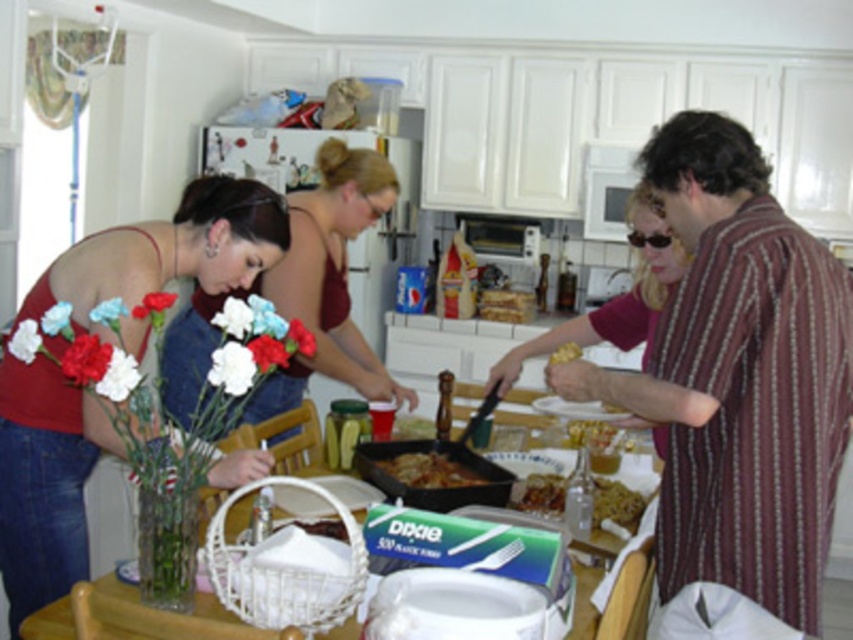
Question: Which point appears farthest from the camera in this image?

Choices:
 (A) (x=554, y=349)
 (B) (x=409, y=476)
 (C) (x=1, y=404)

Answer: (A)

Question: In this image, where is shiny brown rice at center located relative to golden crispy pastry at right?

Choices:
 (A) left
 (B) right

Answer: (B)

Question: Where is brown matte pan at center located in relation to golden crispy fries at center in the image?

Choices:
 (A) left
 (B) right

Answer: (A)

Question: Which point is farther from the camera taking this photo?

Choices:
 (A) (532, 497)
 (B) (128, 253)
 (C) (514, 506)
 (D) (389, 461)

Answer: (D)

Question: Is matte red blouse at left behind brown matte pan at center?

Choices:
 (A) yes
 (B) no

Answer: (B)

Question: Which point is closer to the camera taking this photo?

Choices:
 (A) (358, 184)
 (B) (51, 499)
 (C) (596, 490)
 (D) (570, 356)

Answer: (B)